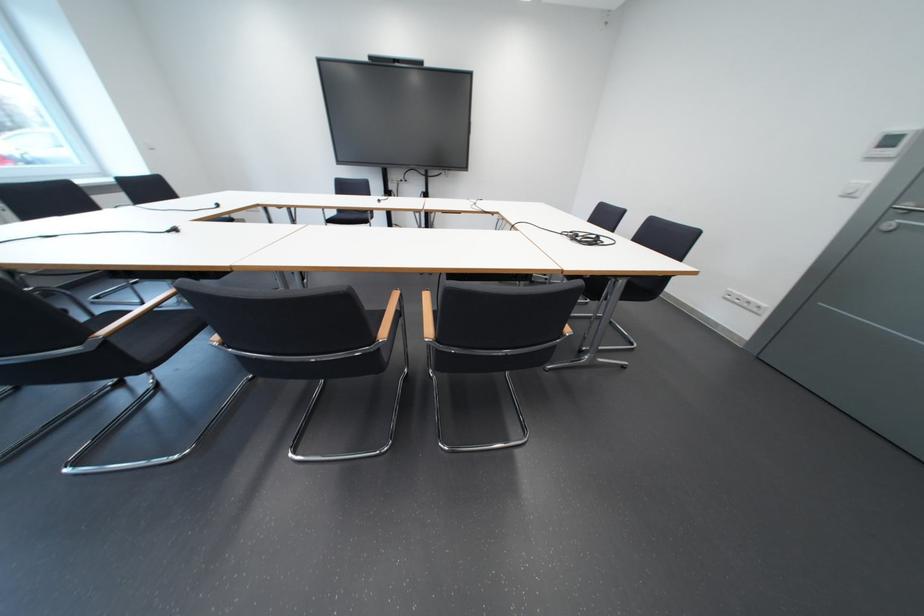
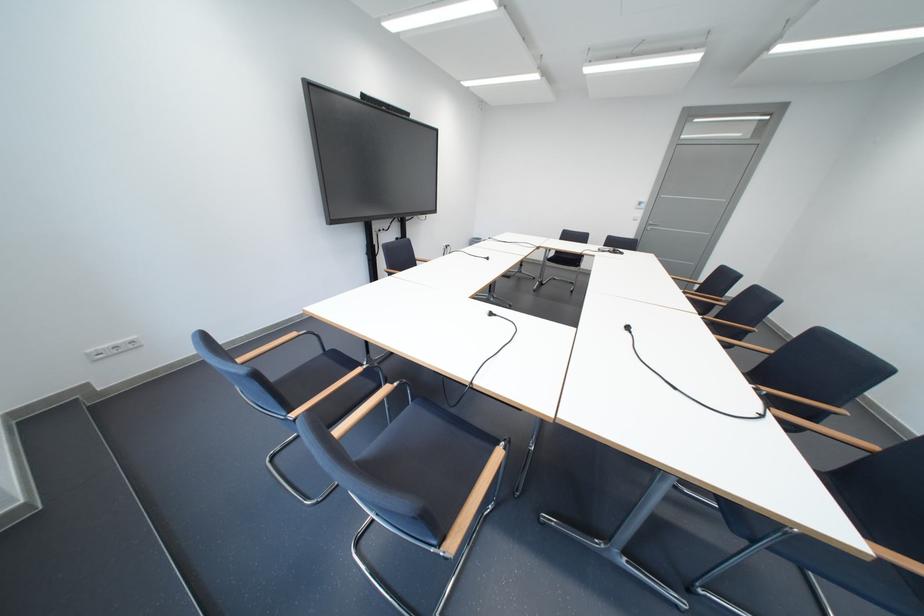
In the second image, find the point that corresponds to pixel 229 207 in the first image.

(503, 315)